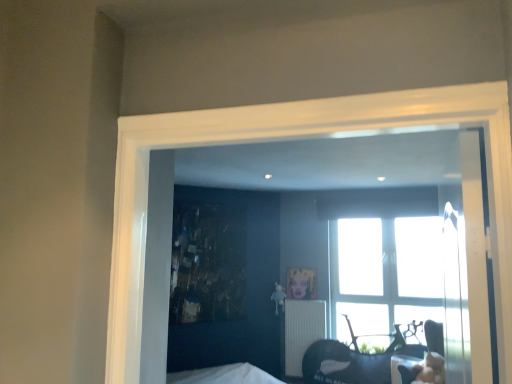
Question: Considering their positions, is matte black chair at lower right located in front of or behind white ribbed radiator at center?

Choices:
 (A) behind
 (B) front

Answer: (B)

Question: Which is correct: matte black chair at lower right is inside white ribbed radiator at center, or outside of it?

Choices:
 (A) outside
 (B) inside

Answer: (A)

Question: Estimate the real-world distances between objects in this image. Which object is farther from the transparent glass window at center?

Choices:
 (A) white ribbed radiator at center
 (B) matte black chair at lower right
 (C) metallic gold picture frame at center

Answer: (C)

Question: Which is farther from the matte black chair at lower right?

Choices:
 (A) transparent glass window at center
 (B) metallic gold picture frame at center
 (C) white ribbed radiator at center

Answer: (B)